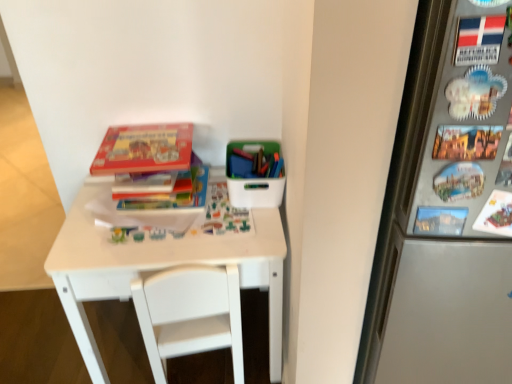
This screenshot has height=384, width=512. I want to click on vacant region in front of white plastic container at upper right, so click(x=236, y=231).